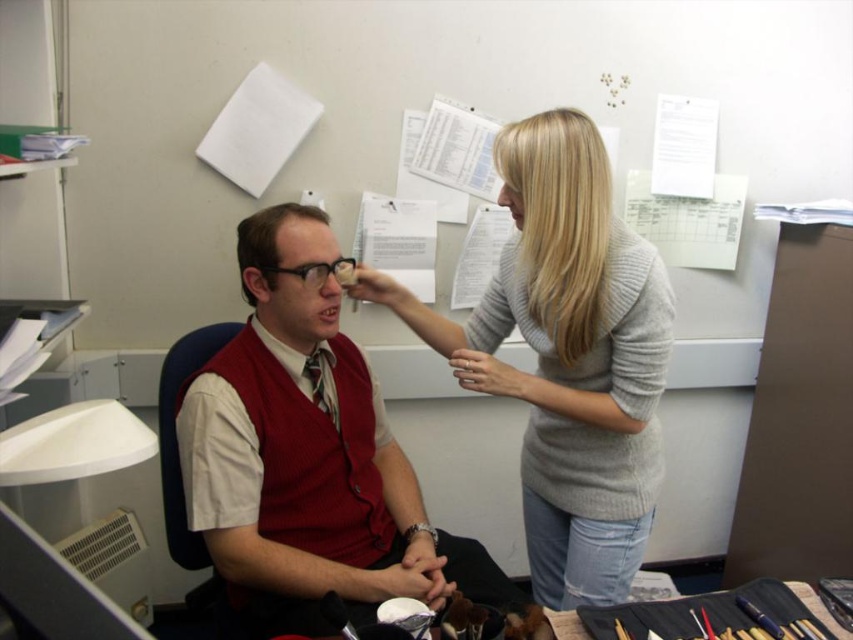
You are an interior designer observing this office scene. You need to place a decorative item between the matte red vest at center and the matte black forehead at center. Based on their positions, which object should the item be placed to the left of?

The matte red vest at center is positioned on the right side of the matte black forehead at center. Therefore, the decorative item should be placed to the left of the matte red vest at center.

You are an office worker who needs to place a new plant in the office. The plant must be placed between the two points labeled point (490, 371) and point (297, 220). Which point should the plant be closer to so that it is in front of the seated person?

The plant should be closer to point (490, 371) because it is in front of point (297, 220), ensuring it is positioned in front of the seated person.